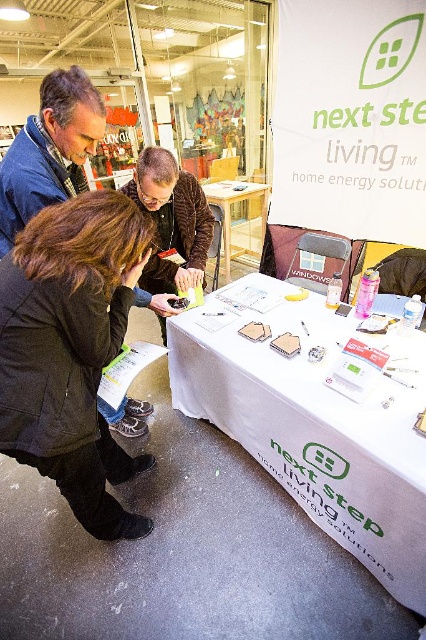
Question: Which point appears closest to the camera in this image?

Choices:
 (A) (157, 177)
 (B) (48, 196)
 (C) (146, 225)
 (D) (322, 360)

Answer: (C)

Question: Which of the following is the farthest from the observer?

Choices:
 (A) brown fuzzy jacket at center
 (B) white wood table at center
 (C) blue denim jacket at upper left

Answer: (B)

Question: From the image, what is the correct spatial relationship of blue denim jacket at upper left in relation to brown fuzzy jacket at center?

Choices:
 (A) below
 (B) above

Answer: (B)

Question: Is blue denim jacket at upper left to the right of white wood table at center from the viewer's perspective?

Choices:
 (A) no
 (B) yes

Answer: (A)

Question: Is brown fuzzy jacket at center closer to the viewer compared to white wood table at center?

Choices:
 (A) yes
 (B) no

Answer: (A)

Question: Estimate the real-world distances between objects in this image. Which object is farther from the brown fuzzy jacket at center?

Choices:
 (A) blue denim jacket at upper left
 (B) white wood table at center
 (C) dark brown leather jacket at lower left

Answer: (B)